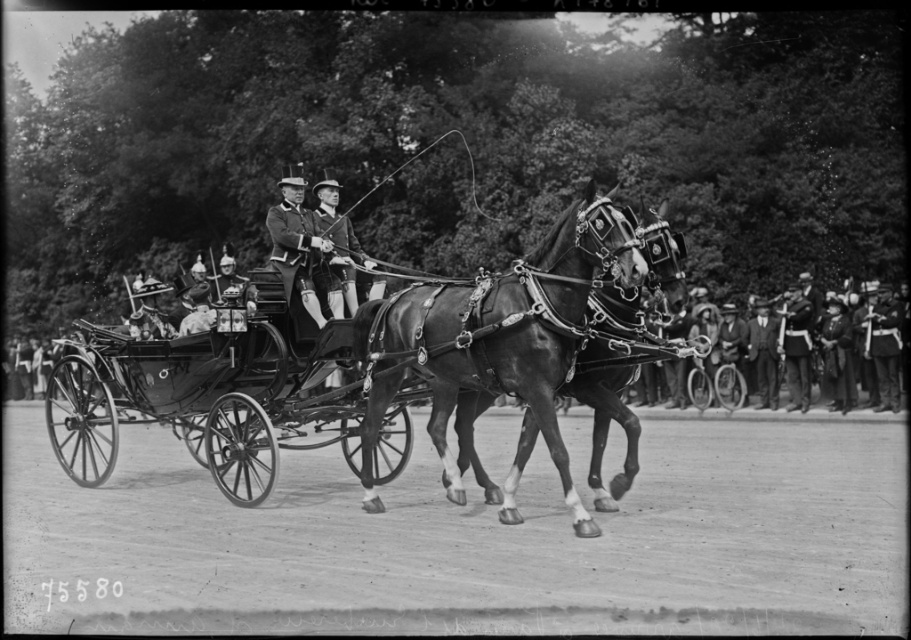
Question: Which object is positioned farthest from the shiny black uniform at center?

Choices:
 (A) smooth leather hat at center
 (B) shiny black horse at center
 (C) smooth leather jacket at right

Answer: (C)

Question: Is shiny black horse at center bigger than shiny black uniform at center?

Choices:
 (A) no
 (B) yes

Answer: (B)

Question: Based on their relative distances, which object is nearer to the smooth leather hat at center?

Choices:
 (A) shiny black uniform at center
 (B) smooth leather jacket at right
 (C) shiny black horse at center

Answer: (A)

Question: Which point appears closest to the camera in this image?

Choices:
 (A) (350, 316)
 (B) (456, 408)
 (C) (280, 269)

Answer: (B)

Question: Is the position of shiny black uniform at center more distant than that of smooth leather hat at center?

Choices:
 (A) yes
 (B) no

Answer: (A)

Question: Does shiny black horse at center have a larger size compared to smooth leather jacket at right?

Choices:
 (A) yes
 (B) no

Answer: (B)